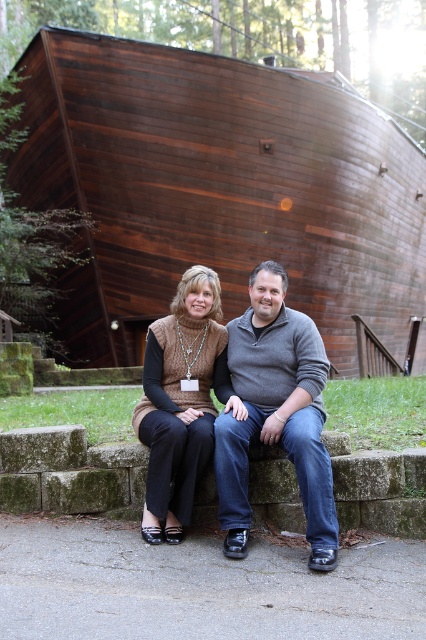
Question: Which object is closer to the camera taking this photo?

Choices:
 (A) gray sweater at center
 (B) dark wood boat at center

Answer: (A)

Question: Which object is positioned farthest from the knit sweater at center?

Choices:
 (A) dark wood boat at center
 (B) gray sweater at center

Answer: (A)

Question: In this image, where is dark wood boat at center located relative to gray sweater at center?

Choices:
 (A) right
 (B) left

Answer: (A)

Question: Observing the image, what is the correct spatial positioning of gray sweater at center in reference to knit sweater at center?

Choices:
 (A) left
 (B) right

Answer: (B)

Question: Among these points, which one is farthest from the camera?

Choices:
 (A) (423, 268)
 (B) (233, 540)

Answer: (A)

Question: Does gray sweater at center appear on the right side of knit sweater at center?

Choices:
 (A) yes
 (B) no

Answer: (A)